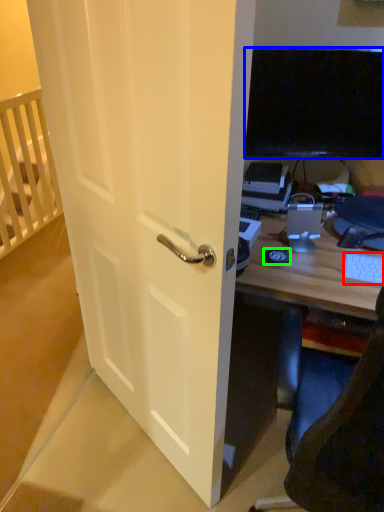
Question: Which object is the closest to the computer keyboard (highlighted by a red box)? Choose among these: television (highlighted by a blue box) or mousepad (highlighted by a green box).

Choices:
 (A) television
 (B) mousepad

Answer: (B)